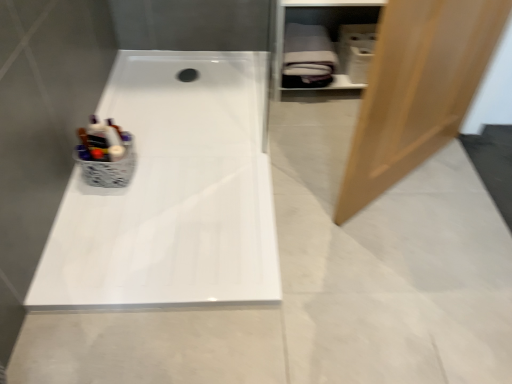
Question: Is white glossy bathtub at center surrounding light brown wood door at right?

Choices:
 (A) yes
 (B) no

Answer: (B)

Question: Can you confirm if white glossy bathtub at center is shorter than light brown wood door at right?

Choices:
 (A) yes
 (B) no

Answer: (A)

Question: From a real-world perspective, is white glossy bathtub at center on light brown wood door at right?

Choices:
 (A) no
 (B) yes

Answer: (A)

Question: Is white glossy bathtub at center at the left side of light brown wood door at right?

Choices:
 (A) no
 (B) yes

Answer: (B)

Question: From the image's perspective, is white glossy bathtub at center on top of light brown wood door at right?

Choices:
 (A) no
 (B) yes

Answer: (A)

Question: From a real-world perspective, relative to white matte shelf at upper right, is white glossy bathtub at center vertically above or below?

Choices:
 (A) below
 (B) above

Answer: (A)

Question: Based on their sizes in the image, would you say white glossy bathtub at center is bigger or smaller than white matte shelf at upper right?

Choices:
 (A) big
 (B) small

Answer: (B)

Question: From the image's perspective, is white glossy bathtub at center located above or below white matte shelf at upper right?

Choices:
 (A) below
 (B) above

Answer: (A)

Question: Is white glossy bathtub at center inside the boundaries of white matte shelf at upper right, or outside?

Choices:
 (A) outside
 (B) inside

Answer: (A)

Question: From the image's perspective, relative to white glossy bathtub at center, is light brown wood door at right above or below?

Choices:
 (A) above
 (B) below

Answer: (A)

Question: Considering the positions of light brown wood door at right and white glossy bathtub at center in the image, is light brown wood door at right wider or thinner than white glossy bathtub at center?

Choices:
 (A) wide
 (B) thin

Answer: (B)

Question: Considering their positions, is light brown wood door at right located in front of or behind white glossy bathtub at center?

Choices:
 (A) front
 (B) behind

Answer: (A)

Question: Looking at the image, does light brown wood door at right seem bigger or smaller compared to white glossy bathtub at center?

Choices:
 (A) small
 (B) big

Answer: (B)

Question: Is light brown wood door at right to the left or to the right of white matte shelf at upper right in the image?

Choices:
 (A) right
 (B) left

Answer: (A)

Question: Do you think light brown wood door at right is within white matte shelf at upper right, or outside of it?

Choices:
 (A) outside
 (B) inside

Answer: (A)